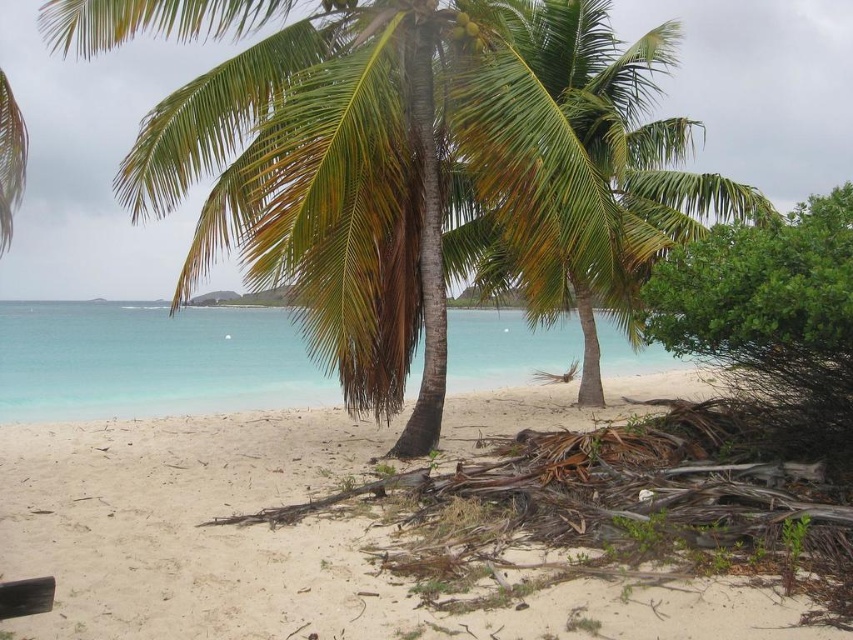
Question: Which point is farther to the camera?

Choices:
 (A) (202, 154)
 (B) (517, 317)
 (C) (151, 522)

Answer: (B)

Question: Can you confirm if green leafy coconut tree at center is positioned below clear blue water at center?

Choices:
 (A) yes
 (B) no

Answer: (B)

Question: Is white sandy beach at lower left wider than clear blue water at center?

Choices:
 (A) yes
 (B) no

Answer: (B)

Question: Which point is farther to the camera?

Choices:
 (A) (83, 518)
 (B) (223, 378)
 (C) (608, 38)

Answer: (B)

Question: Among these objects, which one is nearest to the camera?

Choices:
 (A) clear blue water at center
 (B) green leafy coconut tree at center

Answer: (B)

Question: Does green leafy coconut tree at center lie behind white sandy beach at lower left?

Choices:
 (A) no
 (B) yes

Answer: (B)